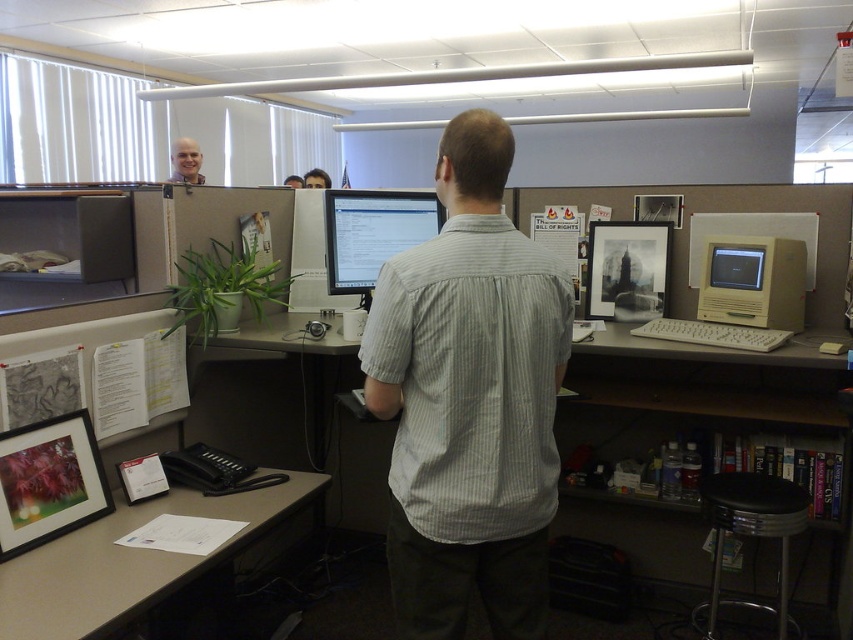
You are standing in the office shown in the image. You need to place a new item at the point with coordinates (694, 392). What object is located at that point?

The point (694, 392) corresponds to the white plastic computer desk at center.

You are looking at the office scene. Where is the gray striped shirt at center located in terms of its 2D coordinates?

The gray striped shirt at center is located at the 2D coordinates of point (469, 400).

You are a visitor in the office and need to sit down at either the white plastic computer desk at center or the black leather stool at lower right. Which one is closer to you?

The white plastic computer desk at center is closer to the viewer than the black leather stool at lower right, so you should choose the white plastic computer desk at center to sit down as it is nearer.